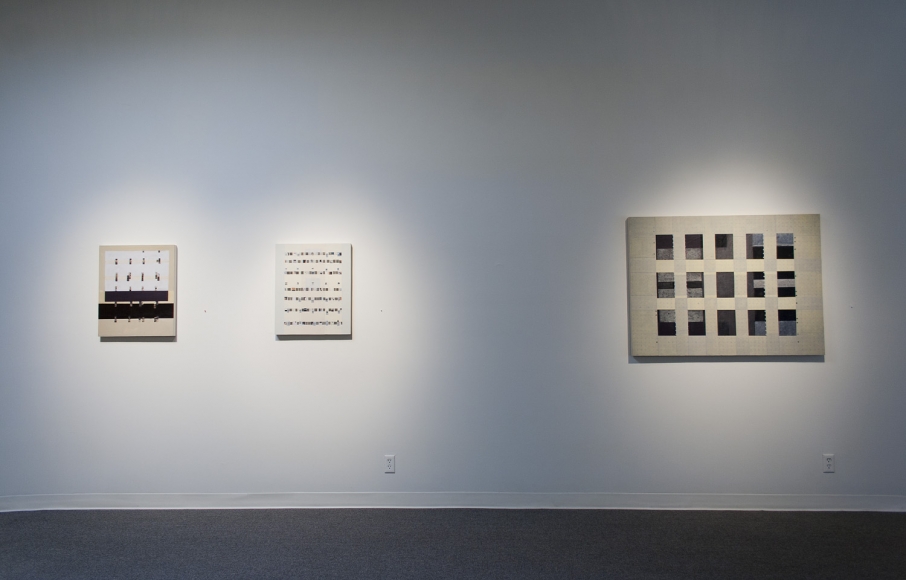
In order to click on left edges of canvases in this screenshot , I will do `click(97, 276)`, `click(271, 278)`, `click(630, 262)`.